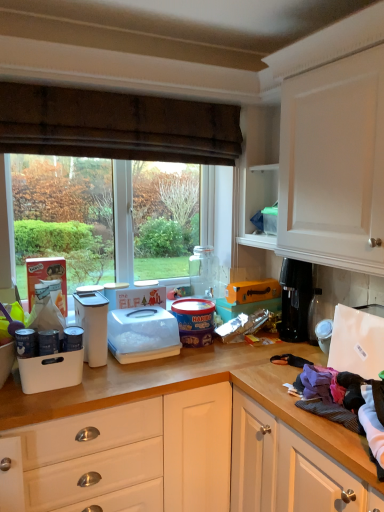
Question: Is point (304, 325) closer or farther from the camera than point (72, 121)?

Choices:
 (A) farther
 (B) closer

Answer: (A)

Question: Is black plastic coffee maker at right, the second appliance in the right-to-left sequence, bigger or smaller than transparent glass window at center?

Choices:
 (A) small
 (B) big

Answer: (A)

Question: Which object is positioned farthest from the orange matte box at center, placed as the 1th box when sorted from bottom to top?

Choices:
 (A) black plastic coffee maker at right, arranged as the 6th appliance when viewed from the left
 (B) transparent glass window at center
 (C) white plastic cutting board at right, positioned as the first appliance in right-to-left order
 (D) white plastic bread bin at center
 (E) metallic silver canister at left, which ranks as the seventh appliance in right-to-left order

Answer: (E)

Question: Based on their relative distances, which object is nearer to the metallic silver canister at center-left, the second appliance from the left?

Choices:
 (A) metallic silver canister at left, which ranks as the seventh appliance in right-to-left order
 (B) brown textured curtain at upper center
 (C) black plastic coffee maker at right, arranged as the 6th appliance when viewed from the left
 (D) orange matte box at center, which is the 2th box from top to bottom
 (E) matte plastic tub at center, which is the 5th appliance from left to right

Answer: (A)